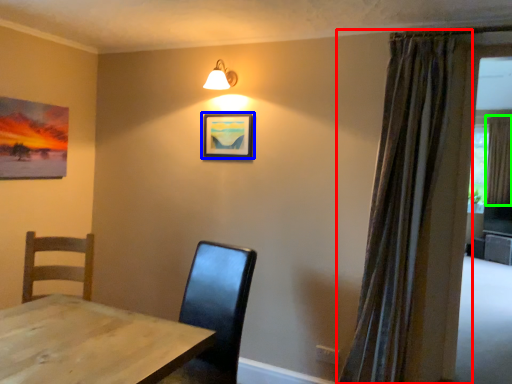
Question: Which object is the closest to the curtain (highlighted by a red box)? Choose among these: picture frame (highlighted by a blue box) or curtain (highlighted by a green box).

Choices:
 (A) picture frame
 (B) curtain

Answer: (A)